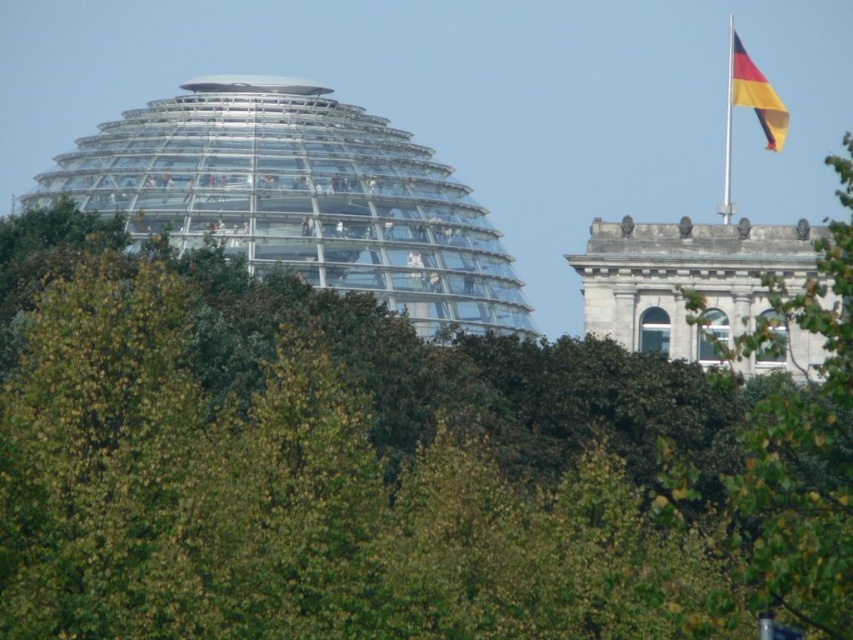
You are standing in a park and want to take a photo of the transparent glass dome at upper left. The trees are blocking your view. Based on the coordinates provided, can you estimate if the dome is visible from your current position?

The transparent glass dome at upper left is located at coordinates point (299,196). Since the trees are blocking the view, you might need to move to a position where the dome is not obscured by the foliage. Check if adjusting your position to the right or left allows you to see the dome at those coordinates without obstruction.